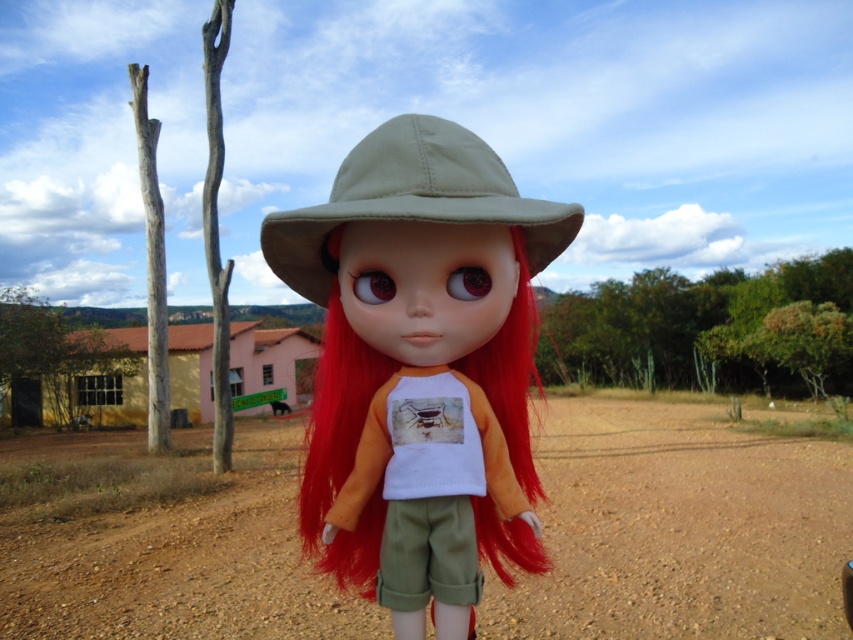
Question: Can you confirm if matte khaki hat at center is smaller than khaki fabric hat at center?

Choices:
 (A) yes
 (B) no

Answer: (B)

Question: Which is farther from the matte khaki hat at center?

Choices:
 (A) brown sandy dirt at center
 (B) khaki fabric hat at center

Answer: (A)

Question: Can you confirm if brown sandy dirt at center is thinner than matte khaki hat at center?

Choices:
 (A) yes
 (B) no

Answer: (B)

Question: Can you confirm if matte khaki hat at center is positioned below khaki fabric hat at center?

Choices:
 (A) yes
 (B) no

Answer: (A)

Question: Among these points, which one is farthest from the camera?

Choices:
 (A) (508, 627)
 (B) (337, 180)
 (C) (376, 147)

Answer: (A)

Question: Which object appears closest to the camera in this image?

Choices:
 (A) khaki fabric hat at center
 (B) brown sandy dirt at center

Answer: (A)